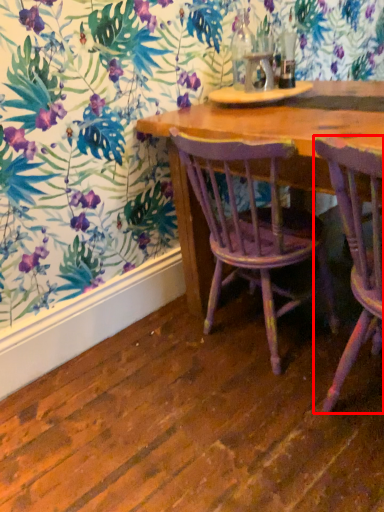
Question: From the image's perspective, what is the correct spatial relationship of chair (annotated by the red box) in relation to chair?

Choices:
 (A) below
 (B) above

Answer: (A)